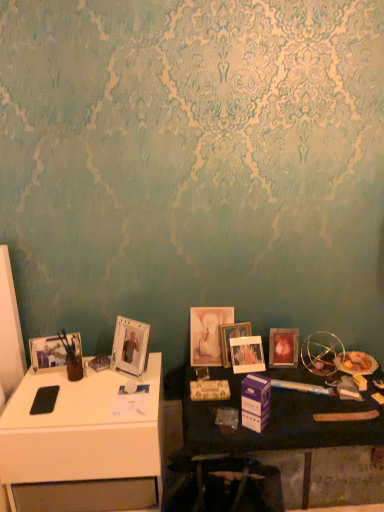
Find the location of a particular element. free space above white glossy desk at left (from a real-world perspective) is located at coordinates (91, 383).